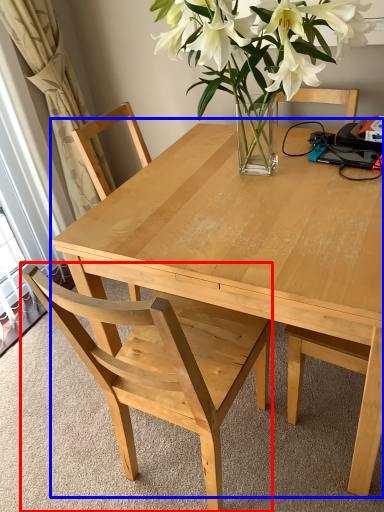
Question: Which object appears farthest to the camera in this image, chair (highlighted by a red box) or kitchen & dining room table (highlighted by a blue box)?

Choices:
 (A) chair
 (B) kitchen & dining room table

Answer: (B)